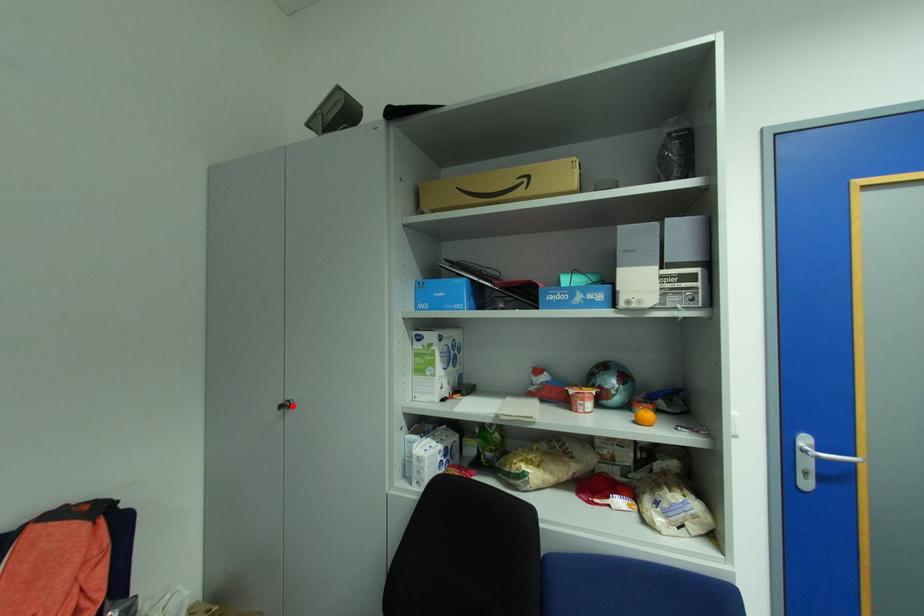
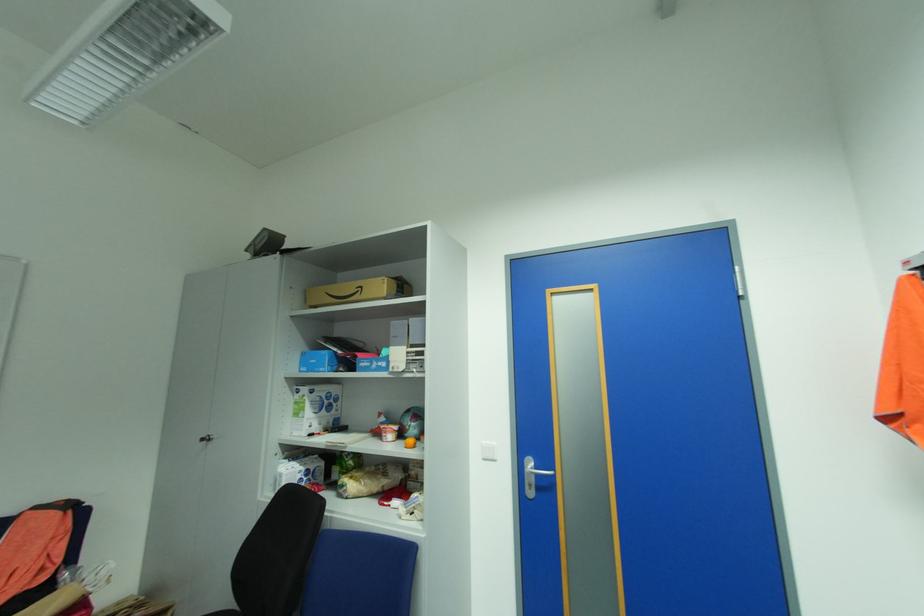
The point at the highlighted location is marked in the first image. Where is the corresponding point in the second image?

(213, 439)